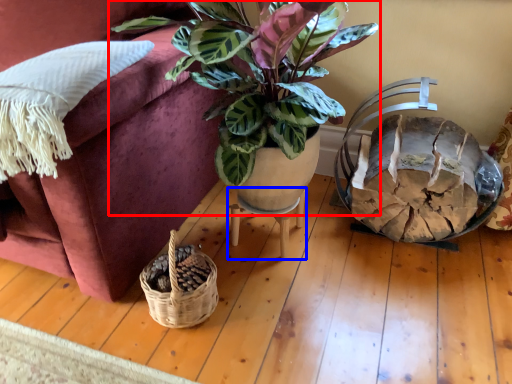
Question: Which object appears closest to the camera in this image, houseplant (highlighted by a red box) or table (highlighted by a blue box)?

Choices:
 (A) houseplant
 (B) table

Answer: (A)